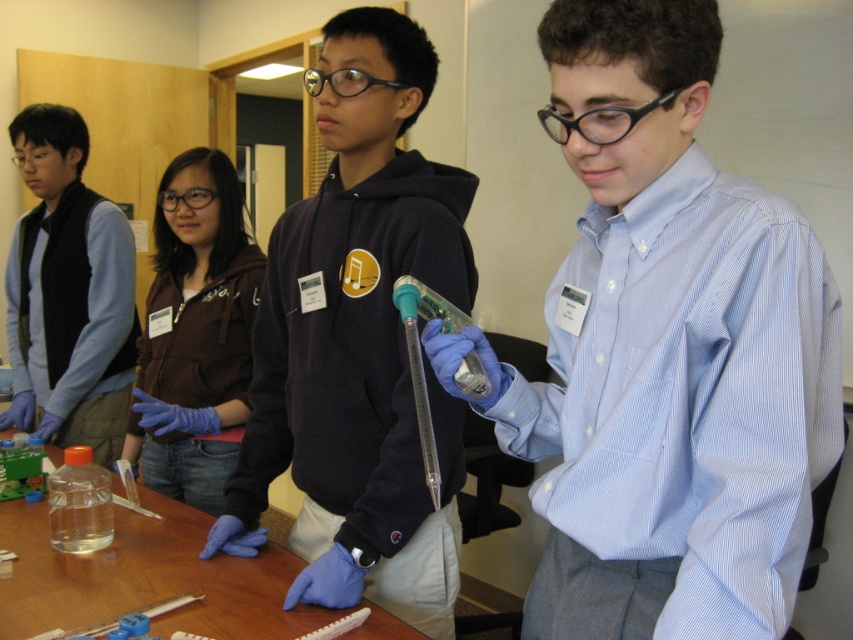
You are standing in the room and want to hand a document to the person wearing the black matte hoodie at center and the brown soft jacket at center. Which person should you approach first to give the document?

You should approach the black matte hoodie at center first because they are closer to you than the brown soft jacket at center.

You are an observer in the room. You notice the blue glossy shirt at center and the transparent plastic table at center. Which object takes up more space in the image?

The blue glossy shirt at center takes up more space in the image because it is larger in size than the transparent plastic table at center.

You are standing in the classroom and see two points marked on the floor. The first point is at coordinates point (x=601, y=177) and the second is at point (x=283, y=582). If you want to walk from the first point to the second point, which direction should you move?

To move from point (x=601, y=177) to point (x=283, y=582), you should move towards the right and forward since the second point is located to the right and in front of the first point.